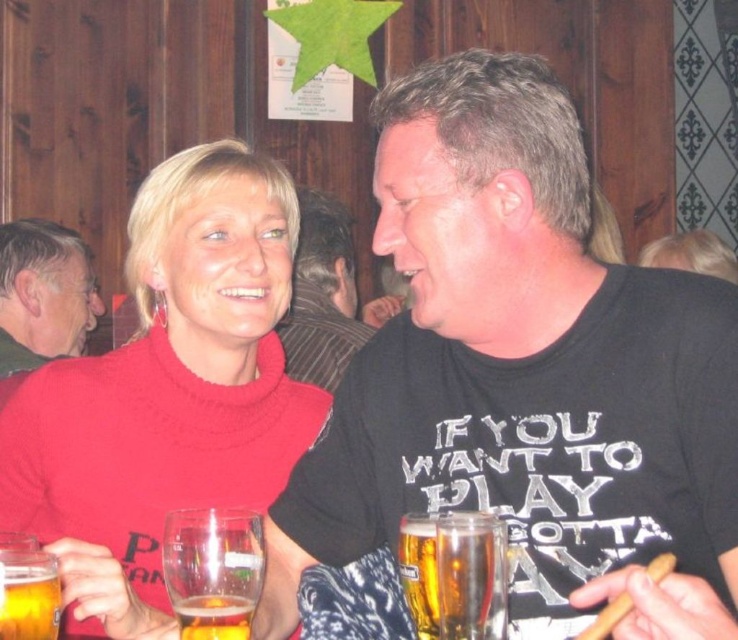
Is black matte t-shirt at center closer to the viewer compared to translucent glass beer at lower center?

No, it is behind translucent glass beer at lower center.

Between black matte t-shirt at center and translucent glass beer at lower center, which one is positioned lower?

translucent glass beer at lower center

The height and width of the screenshot is (640, 738). Identify the location of black matte t-shirt at center. (517, 365).

Does matte black t-shirt at center have a greater width compared to translucent glass beer at lower center?

Yes.

Is matte black t-shirt at center smaller than translucent glass beer at lower center?

Incorrect, matte black t-shirt at center is not smaller in size than translucent glass beer at lower center.

Does point (348, 340) come behind point (241, 604)?

Yes, it is.

I want to click on matte black t-shirt at center, so click(x=320, y=296).

Which is in front, point (213, 422) or point (227, 596)?

Point (227, 596) is more forward.

Find the location of `knitted red sweater at center`. knitted red sweater at center is located at coordinates (170, 381).

In order to click on knitted red sweater at center in this screenshot , I will do `click(170, 381)`.